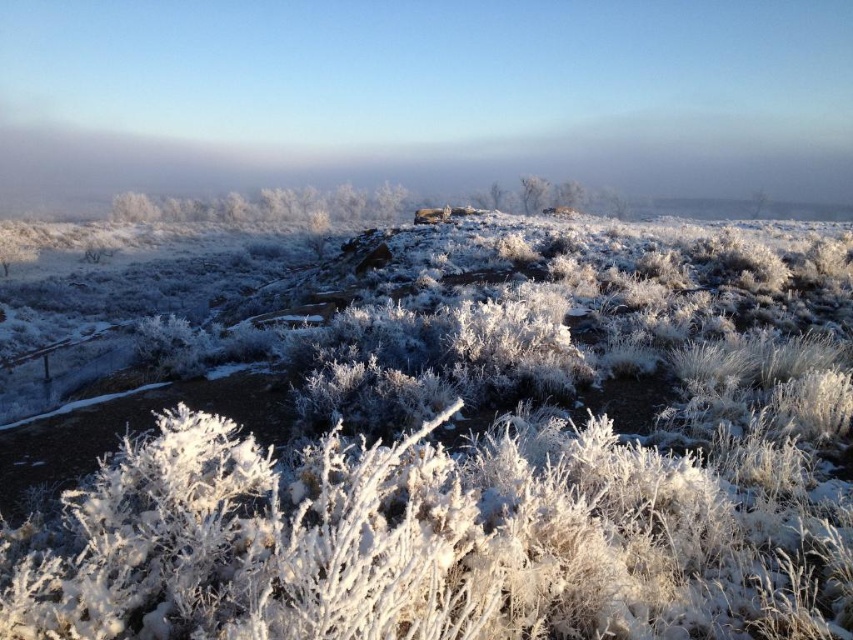
Is frosted grass at center bigger than white frosty bush at center?

No, frosted grass at center is not bigger than white frosty bush at center.

Is frosted grass at center closer to the viewer compared to white frosty bush at center?

Yes, it is in front of white frosty bush at center.

Identify the location of frosted grass at center. (480, 449).

Where is `frosted grass at center`? frosted grass at center is located at coordinates (480, 449).

Is frosted grass at center positioned at the back of white frosty tree at center?

No, it is in front of white frosty tree at center.

Who is taller, frosted grass at center or white frosty tree at center?

white frosty tree at center is taller.

Does point (117, 589) come closer to viewer compared to point (547, 184)?

Yes, it is.

I want to click on frosted grass at center, so click(x=480, y=449).

Between white frosty bush at center and white frosty tree at center, which one appears on the left side from the viewer's perspective?

Positioned to the left is white frosty tree at center.

Is white frosty bush at center below white frosty tree at center?

Indeed, white frosty bush at center is positioned under white frosty tree at center.

The width and height of the screenshot is (853, 640). I want to click on white frosty bush at center, so click(x=550, y=198).